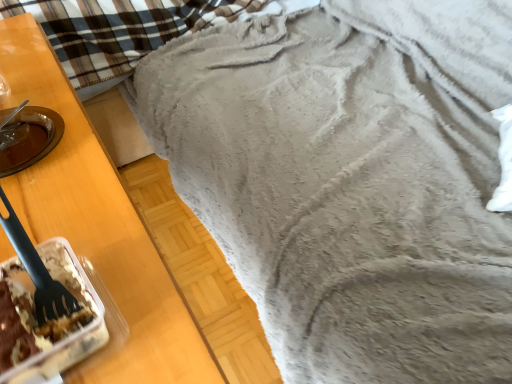
Where is `translucent plastic container with cake at lower left`? translucent plastic container with cake at lower left is located at coordinates (48, 323).

What is the approximate width of black plastic fork at left?

It is 1.39 inches.

At what (x,y) coordinates should I click in order to perform the action: click on fuzzy gray blanket at upper right. Please return your answer as a coordinate pair (x, y). Looking at the image, I should click on (98, 229).

Image resolution: width=512 pixels, height=384 pixels. Find the location of `translucent plastic container with cake at lower left`. translucent plastic container with cake at lower left is located at coordinates (48, 323).

Is point (41, 350) farther from camera compared to point (149, 246)?

No, it is not.

Considering the relative sizes of translucent plastic container with cake at lower left and fuzzy gray blanket at upper right in the image provided, is translucent plastic container with cake at lower left taller than fuzzy gray blanket at upper right?

No, translucent plastic container with cake at lower left is not taller than fuzzy gray blanket at upper right.

Is translucent plastic container with cake at lower left situated inside fuzzy gray blanket at upper right or outside?

translucent plastic container with cake at lower left is outside fuzzy gray blanket at upper right.

From the image's perspective, who appears lower, translucent plastic container with cake at lower left or black plastic fork at left?

translucent plastic container with cake at lower left is shown below in the image.

Can you confirm if translucent plastic container with cake at lower left is smaller than black plastic fork at left?

Incorrect, translucent plastic container with cake at lower left is not smaller in size than black plastic fork at left.

Which object is positioned more to the left, translucent plastic container with cake at lower left or black plastic fork at left?

From the viewer's perspective, black plastic fork at left appears more on the left side.

Is fuzzy gray blanket at upper right not near translucent plastic container with cake at lower left?

fuzzy gray blanket at upper right is actually quite close to translucent plastic container with cake at lower left.

Does point (159, 332) come behind point (20, 320)?

Yes, point (159, 332) is behind point (20, 320).

Looking at their sizes, would you say fuzzy gray blanket at upper right is wider or thinner than translucent plastic container with cake at lower left?

Considering their sizes, fuzzy gray blanket at upper right looks broader than translucent plastic container with cake at lower left.

Based on the photo, who is more distant, fuzzy gray blanket at upper right or translucent plastic container with cake at lower left?

translucent plastic container with cake at lower left is behind.

Is black plastic fork at left positioned with its back to fuzzy gray blanket at upper right?

No, black plastic fork at left's orientation is not away from fuzzy gray blanket at upper right.

Consider the image. Is black plastic fork at left far away from fuzzy gray blanket at upper right?

Actually, black plastic fork at left and fuzzy gray blanket at upper right are a little close together.

From a real-world perspective, is black plastic fork at left on top of fuzzy gray blanket at upper right?

Correct, in the physical world, black plastic fork at left is higher than fuzzy gray blanket at upper right.

Considering the points (47, 317) and (85, 124), which point is in front, point (47, 317) or point (85, 124)?

Positioned in front is point (47, 317).

Is fuzzy gray blanket at upper right directly adjacent to black plastic fork at left?

No, fuzzy gray blanket at upper right is not making contact with black plastic fork at left.

In the scene shown: Is fuzzy gray blanket at upper right oriented away from black plastic fork at left?

That's not correct — fuzzy gray blanket at upper right is not looking away from black plastic fork at left.

The width and height of the screenshot is (512, 384). I want to click on silverware above the fuzzy gray blanket at upper right (from a real-world perspective), so click(x=37, y=271).

Is translucent plastic container with cake at lower left inside black plastic fork at left?

No.

In the scene shown: Is black plastic fork at left in front of translucent plastic container with cake at lower left?

No, black plastic fork at left is behind translucent plastic container with cake at lower left.

Between black plastic fork at left and translucent plastic container with cake at lower left, which one appears on the right side from the viewer's perspective?

translucent plastic container with cake at lower left.

From the picture: What's the angular difference between black plastic fork at left and translucent plastic container with cake at lower left's facing directions?

The angle between the facing direction of black plastic fork at left and the facing direction of translucent plastic container with cake at lower left is 0.00498 degrees.

At what (x,y) coordinates should I click in order to perform the action: click on furniture that appears above the translucent plastic container with cake at lower left (from the image's perspective). Please return your answer as a coordinate pair (x, y). The height and width of the screenshot is (384, 512). Looking at the image, I should click on (98, 229).

Locate an element on the screen. silverware behind the translucent plastic container with cake at lower left is located at coordinates pyautogui.click(x=37, y=271).

Estimate the real-world distances between objects in this image. Which object is further from fuzzy gray blanket at upper right, translucent plastic container with cake at lower left or black plastic fork at left?

black plastic fork at left.

Which object lies further to the anchor point translucent plastic container with cake at lower left, black plastic fork at left or fuzzy gray blanket at upper right?

fuzzy gray blanket at upper right is further to translucent plastic container with cake at lower left.

Looking at the image, which one is located further to translucent plastic container with cake at lower left, fuzzy gray blanket at upper right or black plastic fork at left?

fuzzy gray blanket at upper right lies further to translucent plastic container with cake at lower left than the other object.

Looking at the image, which one is located further to black plastic fork at left, fuzzy gray blanket at upper right or translucent plastic container with cake at lower left?

fuzzy gray blanket at upper right is positioned further to the anchor black plastic fork at left.

When comparing their distances from black plastic fork at left, does translucent plastic container with cake at lower left or fuzzy gray blanket at upper right seem closer?

The object closer to black plastic fork at left is translucent plastic container with cake at lower left.

From the image, which object appears to be farther from fuzzy gray blanket at upper right, black plastic fork at left or translucent plastic container with cake at lower left?

black plastic fork at left is further to fuzzy gray blanket at upper right.

The width and height of the screenshot is (512, 384). What are the coordinates of `silverware between fuzzy gray blanket at upper right and translucent plastic container with cake at lower left` in the screenshot? It's located at (37, 271).